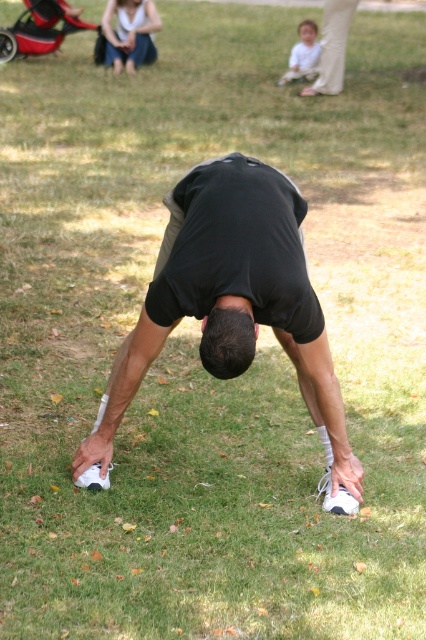
Question: Among these points, which one is nearest to the camera?

Choices:
 (A) (233, 269)
 (B) (141, 29)

Answer: (A)

Question: Can you confirm if black matte shorts at center is smaller than red plastic baby carriage at upper left?

Choices:
 (A) yes
 (B) no

Answer: (A)

Question: Is white cotton shirt at upper left above red plastic baby carriage at upper left?

Choices:
 (A) no
 (B) yes

Answer: (A)

Question: Which point is closer to the camera?

Choices:
 (A) (36, 16)
 (B) (120, 19)
 (C) (330, 461)

Answer: (C)

Question: Among these points, which one is farthest from the camera?

Choices:
 (A) (187, 273)
 (B) (6, 51)

Answer: (B)

Question: Can you confirm if white cotton shirt at upper left is bigger than red plastic baby carriage at upper left?

Choices:
 (A) yes
 (B) no

Answer: (A)